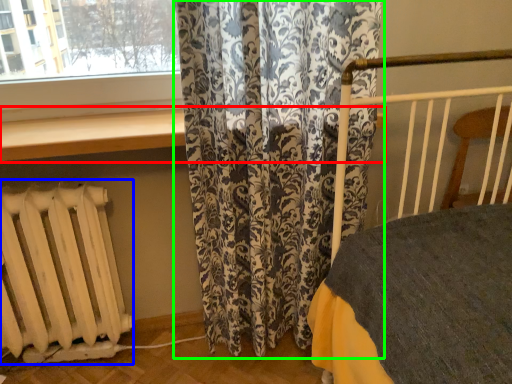
Question: Based on their relative distances, which object is farther from window sill (highlighted by a red box)? Choose from radiator (highlighted by a blue box) and curtain (highlighted by a green box).

Choices:
 (A) radiator
 (B) curtain

Answer: (A)